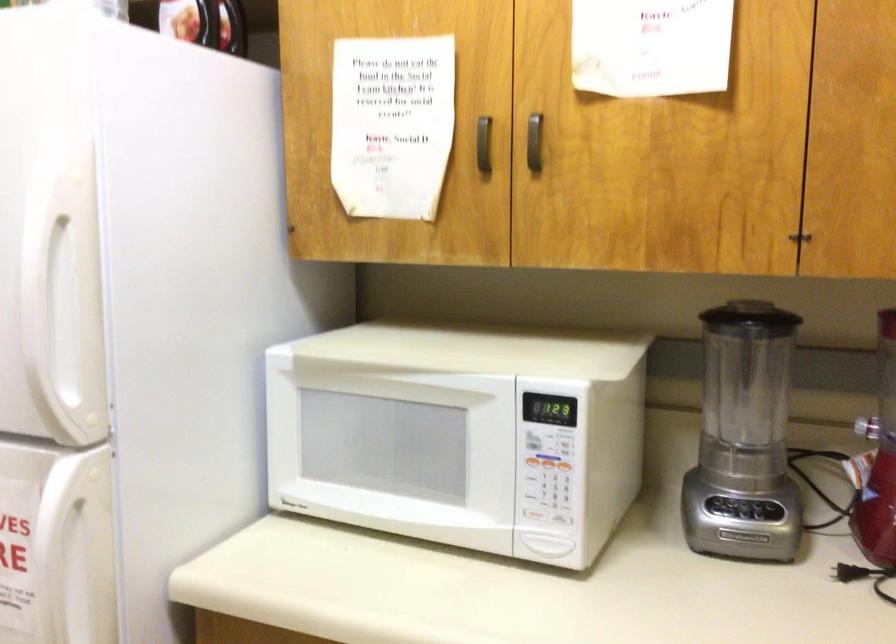
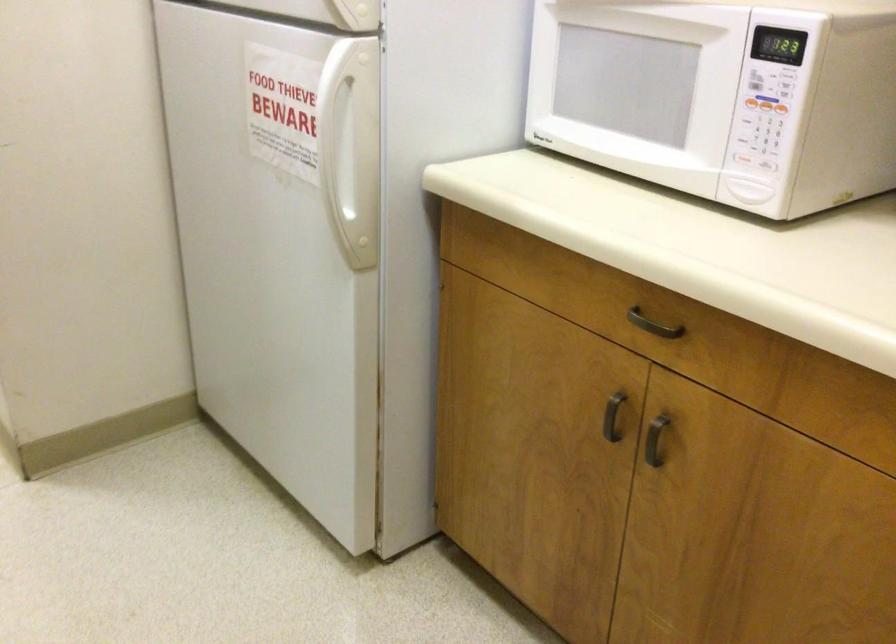
Where in the second image is the point corresponding to point 563,522 from the first image?

(764, 164)